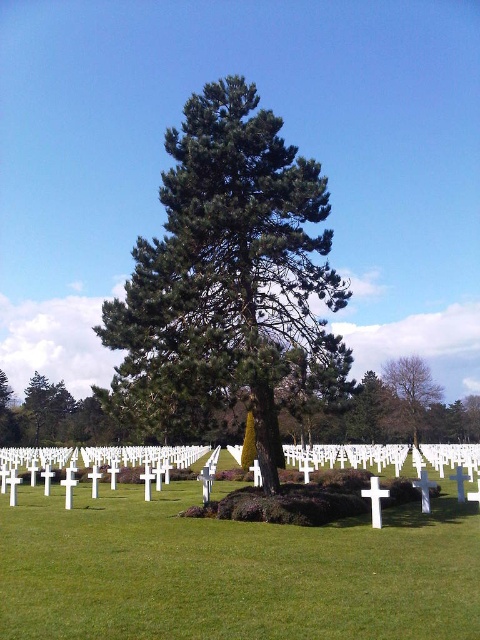
Question: Which of the following is the farthest from the observer?

Choices:
 (A) (414, 404)
 (B) (249, 160)

Answer: (A)

Question: Does green textured tree at center appear over smooth brown tree at right?

Choices:
 (A) no
 (B) yes

Answer: (B)

Question: Is green textured tree at center behind smooth brown tree at right?

Choices:
 (A) no
 (B) yes

Answer: (A)

Question: Can you confirm if green textured tree at center is positioned below smooth brown tree at right?

Choices:
 (A) no
 (B) yes

Answer: (A)

Question: Which point is farther from the camera taking this photo?

Choices:
 (A) (260, 410)
 (B) (425, 401)

Answer: (B)

Question: Which of the following is the closest to the observer?

Choices:
 (A) (300, 193)
 (B) (405, 396)

Answer: (A)